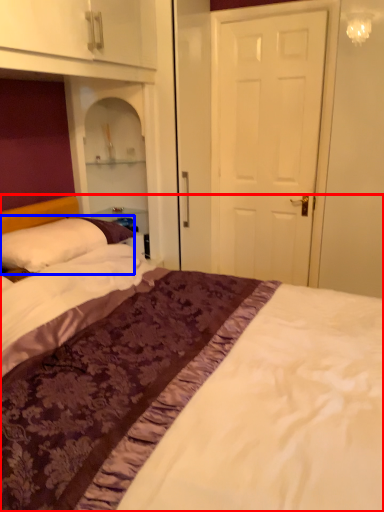
Question: Which point is further to the camera, bed (highlighted by a red box) or pillow (highlighted by a blue box)?

Choices:
 (A) bed
 (B) pillow

Answer: (B)